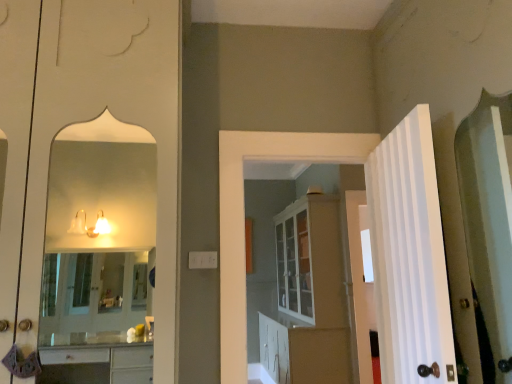
Question: Considering the relative sizes of white glossy cabinet at center and white glossy door at right, the third door in the front-to-back sequence, in the image provided, is white glossy cabinet at center smaller than white glossy door at right, the third door in the front-to-back sequence,?

Choices:
 (A) yes
 (B) no

Answer: (B)

Question: Does white glossy cabinet at center have a greater width compared to white glossy door at right, which is counted as the 3th door, starting from the left?

Choices:
 (A) yes
 (B) no

Answer: (A)

Question: Is white glossy cabinet at center shorter than white glossy door at right, which is the 1th door in right-to-left order?

Choices:
 (A) yes
 (B) no

Answer: (B)

Question: Are white glossy cabinet at center and white glossy door at right, the third door in the front-to-back sequence, making contact?

Choices:
 (A) no
 (B) yes

Answer: (A)

Question: From the image's perspective, is white glossy cabinet at center located beneath white glossy door at right, which is the 1th door in back-to-front order?

Choices:
 (A) no
 (B) yes

Answer: (B)

Question: Does white glossy cabinet at center have a lesser width compared to white glossy door at right, the third door in the front-to-back sequence?

Choices:
 (A) no
 (B) yes

Answer: (A)

Question: From a real-world perspective, is white striped door at right, which appears as the first door when viewed from the front, over white glossy cabinet at center?

Choices:
 (A) yes
 (B) no

Answer: (A)

Question: From the image's perspective, would you say white striped door at right, placed as the second door when sorted from left to right, is shown under white glossy cabinet at center?

Choices:
 (A) yes
 (B) no

Answer: (B)

Question: Considering the relative sizes of white striped door at right, which ranks as the third door in back-to-front order, and white glossy cabinet at center in the image provided, is white striped door at right, which ranks as the third door in back-to-front order, smaller than white glossy cabinet at center?

Choices:
 (A) no
 (B) yes

Answer: (B)

Question: Does white striped door at right, which appears as the 2th door when viewed from the right, have a larger size compared to white glossy cabinet at center?

Choices:
 (A) no
 (B) yes

Answer: (A)

Question: Is white glossy cabinet at center located within white striped door at right, which ranks as the third door in back-to-front order?

Choices:
 (A) no
 (B) yes

Answer: (A)

Question: Is white striped door at right, which ranks as the third door in back-to-front order, directly adjacent to white glossy cabinet at center?

Choices:
 (A) yes
 (B) no

Answer: (B)

Question: Is white striped door at right, placed as the second door when sorted from left to right, surrounded by white glossy cabinet at center?

Choices:
 (A) yes
 (B) no

Answer: (B)